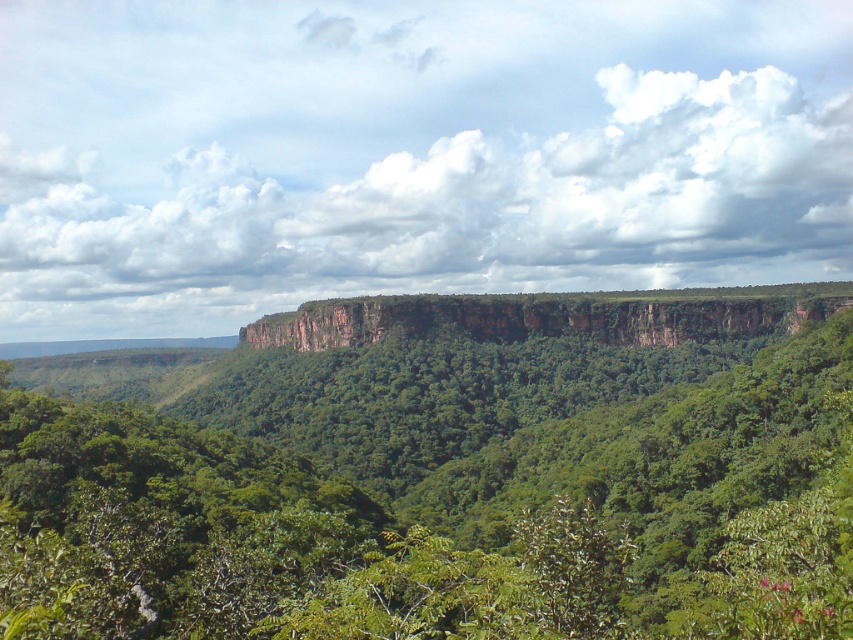
Which is above, green leafy tree at center or brown rocky cliff at center?

brown rocky cliff at center

Can you confirm if green leafy tree at center is shorter than brown rocky cliff at center?

Incorrect, green leafy tree at center's height does not fall short of brown rocky cliff at center's.

Is point (646, 353) positioned before point (506, 296)?

Yes, point (646, 353) is in front of point (506, 296).

You are a GUI agent. You are given a task and a screenshot of the screen. Output one action in this format:
    pyautogui.click(x=<x>, y=<y>)
    Task: Click on the green leafy tree at center
    
    Given the screenshot: What is the action you would take?
    pyautogui.click(x=419, y=488)